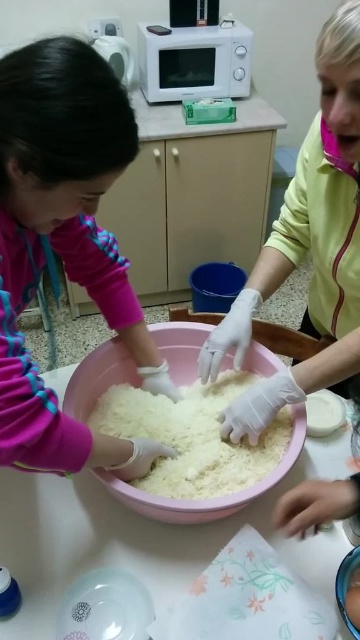
Is point (18, 163) farther from viewer compared to point (186, 88)?

No, (18, 163) is closer to viewer.

Where is `pink fabric at center`? pink fabric at center is located at coordinates (64, 243).

What do you see at coordinates (64, 243) in the screenshot?
I see `pink fabric at center` at bounding box center [64, 243].

Locate an element on the screen. pink fabric at center is located at coordinates (64, 243).

Does point (24, 438) lie in front of point (60, 524)?

Yes.

Who is lower down, pink fabric at center or white glossy table at center?

Positioned lower is white glossy table at center.

Image resolution: width=360 pixels, height=640 pixels. I want to click on pink fabric at center, so click(x=64, y=243).

Is pink fabric at center bigger than white fluffy rice at center?

Yes.

Who is taller, pink fabric at center or white fluffy rice at center?

pink fabric at center is taller.

Find the location of a particular element. pink fabric at center is located at coordinates (64, 243).

I want to click on pink fabric at center, so click(64, 243).